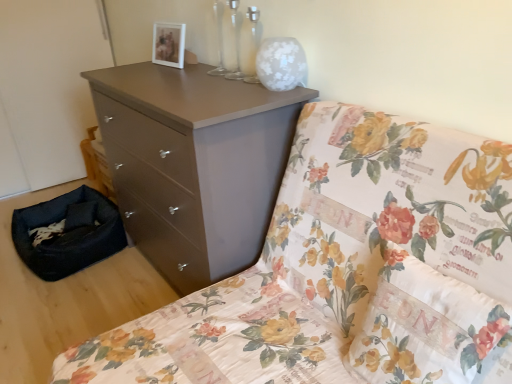
Question: Is point (242, 150) closer or farther from the camera than point (335, 301)?

Choices:
 (A) farther
 (B) closer

Answer: (A)

Question: Considering the positions of matte brown chest of drawers at upper center and matte brown dresser at center in the image, is matte brown chest of drawers at upper center bigger or smaller than matte brown dresser at center?

Choices:
 (A) big
 (B) small

Answer: (B)

Question: Which object is the closest to the floral fabric pillow at center?

Choices:
 (A) matte brown chest of drawers at upper center
 (B) matte brown dresser at center
 (C) black fabric pet bed at lower left

Answer: (B)

Question: Which object is the closest to the floral fabric pillow at center?

Choices:
 (A) matte brown dresser at center
 (B) black fabric pet bed at lower left
 (C) matte brown chest of drawers at upper center

Answer: (A)